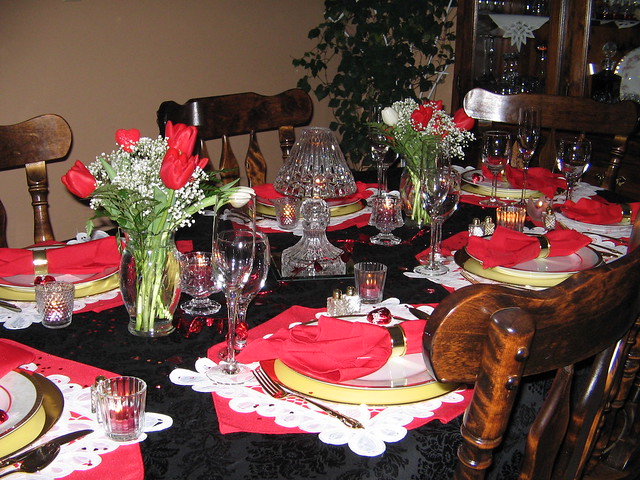
Identify the location of dining room chairs. This screenshot has height=480, width=640. (36, 155), (244, 115), (563, 103), (537, 345).